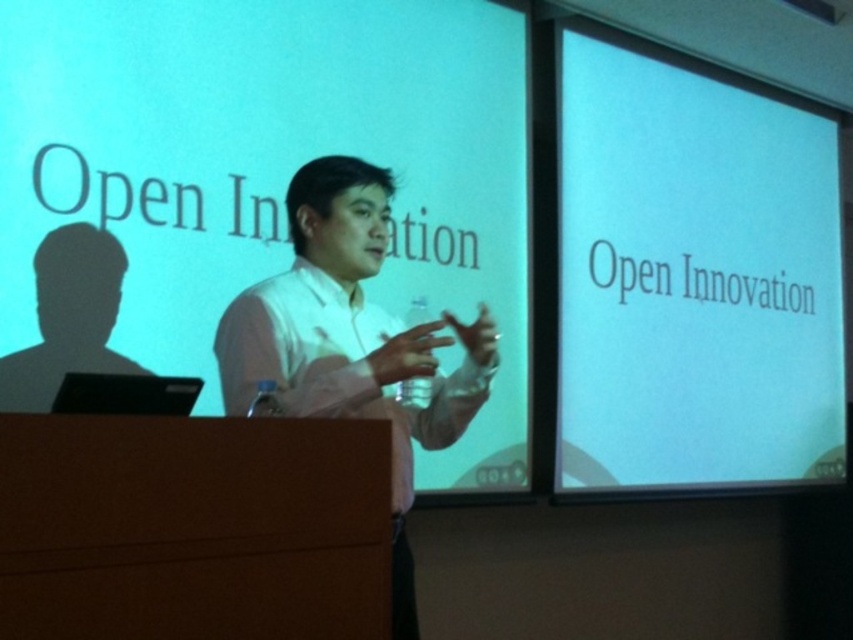
You are an attendee at the presentation and want to take a photo of the white matte projection screen at upper right without including the white shirt at center in the frame. Is this possible given their positions?

The white matte projection screen at upper right is positioned over the white shirt at center, so taking a photo of the screen would likely include the shirt in the frame due to their overlapping positions.

You are setting up a projector for a presentation and need to aim it at the matte white screen at upper center. According to the room layout, where should you position the projector to ensure it faces the correct screen?

The matte white screen at upper center is located at point (270, 168), so you should position the projector to aim at those coordinates to ensure it faces the correct screen.